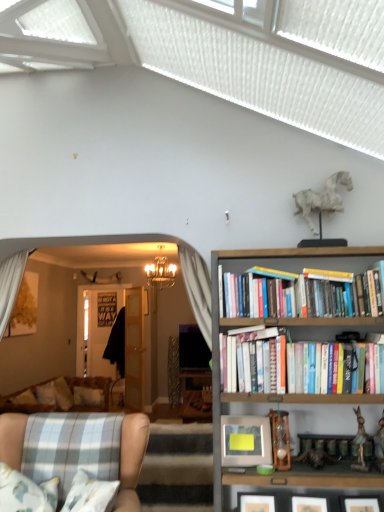
Question: From the image's perspective, is wooden bookshelf at upper right on plaid fabric armchair at lower left?

Choices:
 (A) no
 (B) yes

Answer: (B)

Question: Is wooden bookshelf at upper right smaller than plaid fabric armchair at lower left?

Choices:
 (A) yes
 (B) no

Answer: (B)

Question: Are wooden bookshelf at upper right and plaid fabric armchair at lower left located far from each other?

Choices:
 (A) yes
 (B) no

Answer: (B)

Question: Is wooden bookshelf at upper right further to camera compared to plaid fabric armchair at lower left?

Choices:
 (A) yes
 (B) no

Answer: (A)

Question: Is wooden bookshelf at upper right outside of plaid fabric armchair at lower left?

Choices:
 (A) yes
 (B) no

Answer: (A)

Question: Considering the positions of point (160, 280) and point (3, 459), is point (160, 280) closer or farther from the camera than point (3, 459)?

Choices:
 (A) closer
 (B) farther

Answer: (B)

Question: From a real-world perspective, relative to plaid fabric armchair at lower left, is crystal chandelier at center vertically above or below?

Choices:
 (A) below
 (B) above

Answer: (B)

Question: In the image, is crystal chandelier at center positioned in front of or behind plaid fabric armchair at lower left?

Choices:
 (A) behind
 (B) front

Answer: (A)

Question: Is crystal chandelier at center spatially inside plaid fabric armchair at lower left, or outside of it?

Choices:
 (A) inside
 (B) outside

Answer: (B)

Question: Is crystal chandelier at center to the left or to the right of metallic silver picture frame at right in the image?

Choices:
 (A) left
 (B) right

Answer: (A)

Question: From the image's perspective, relative to metallic silver picture frame at right, is crystal chandelier at center above or below?

Choices:
 (A) below
 (B) above

Answer: (B)

Question: Is crystal chandelier at center spatially inside metallic silver picture frame at right, or outside of it?

Choices:
 (A) inside
 (B) outside

Answer: (B)

Question: Considering the positions of crystal chandelier at center and metallic silver picture frame at right in the image, is crystal chandelier at center bigger or smaller than metallic silver picture frame at right?

Choices:
 (A) small
 (B) big

Answer: (B)

Question: From the image's perspective, is wooden bookshelf at upper right above or below crystal chandelier at center?

Choices:
 (A) below
 (B) above

Answer: (A)

Question: Looking at their shapes, would you say wooden bookshelf at upper right is wider or thinner than crystal chandelier at center?

Choices:
 (A) wide
 (B) thin

Answer: (B)